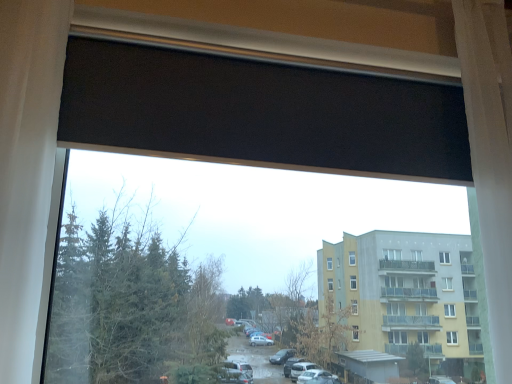
The height and width of the screenshot is (384, 512). What do you see at coordinates (260, 113) in the screenshot?
I see `black fabric at upper center` at bounding box center [260, 113].

Measure the distance between black fabric at upper center and camera.

black fabric at upper center and camera are 1.01 meters apart.

Locate an element on the screen. black fabric at upper center is located at coordinates (260, 113).

At what (x,y) coordinates should I click in order to perform the action: click on black fabric at upper center. Please return your answer as a coordinate pair (x, y). The height and width of the screenshot is (384, 512). Looking at the image, I should click on (260, 113).